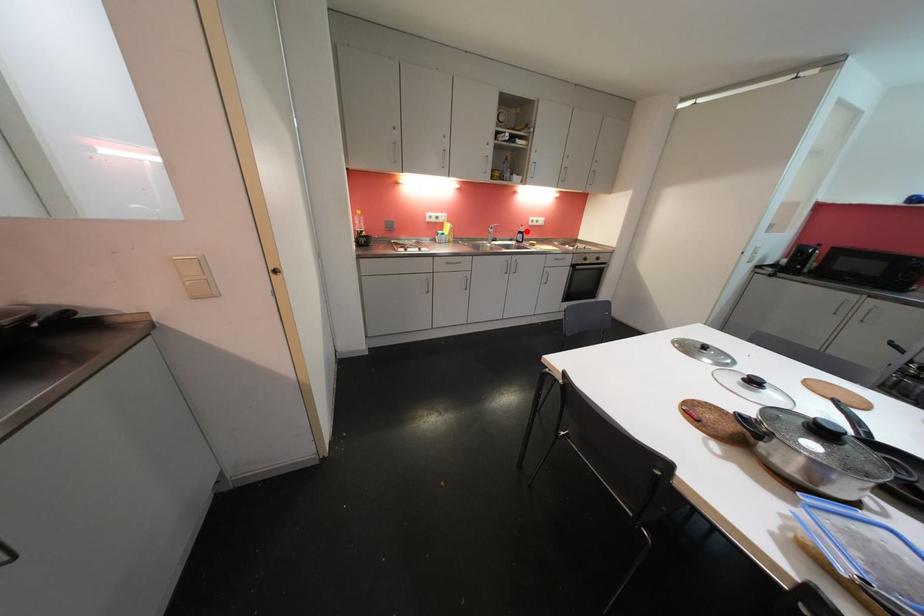
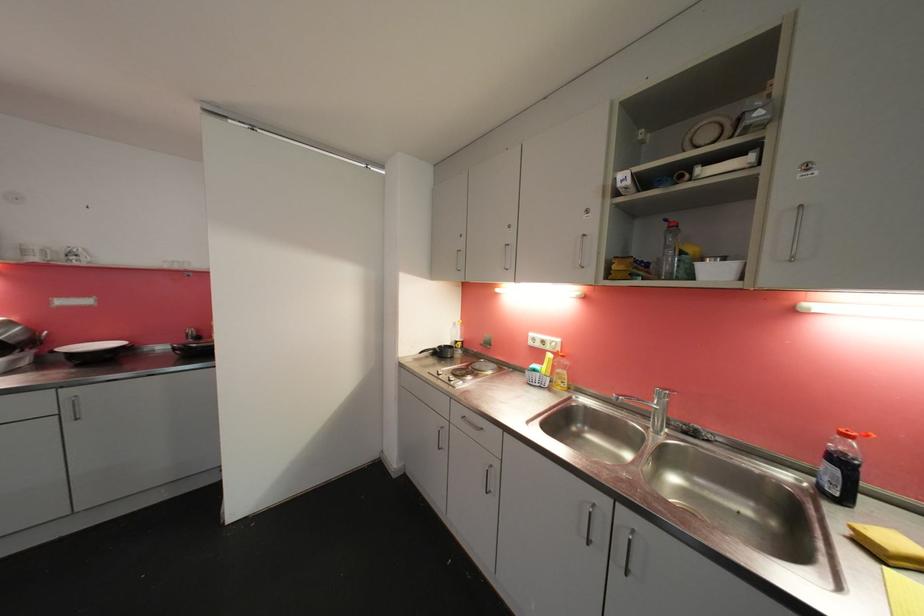
Find the pixel in the second image that matches the highlighted location in the first image.

(850, 450)